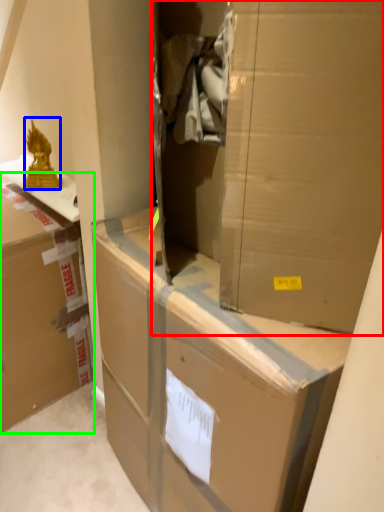
Question: Which object is positioned farthest from cardboard box (highlighted by a red box)? Select from wrap (highlighted by a blue box) and box (highlighted by a green box).

Choices:
 (A) wrap
 (B) box

Answer: (A)